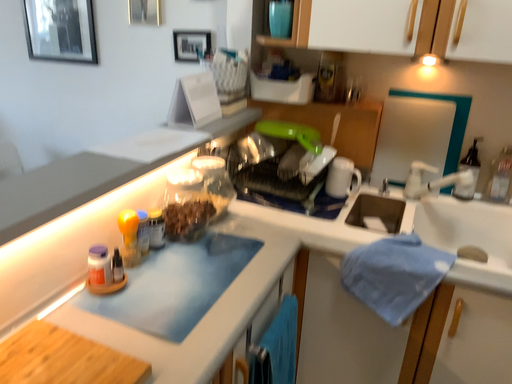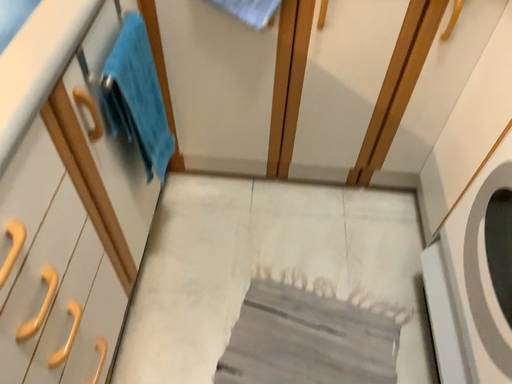
Question: Which way did the camera rotate in the video?

Choices:
 (A) rotated upward
 (B) rotated downward

Answer: (B)